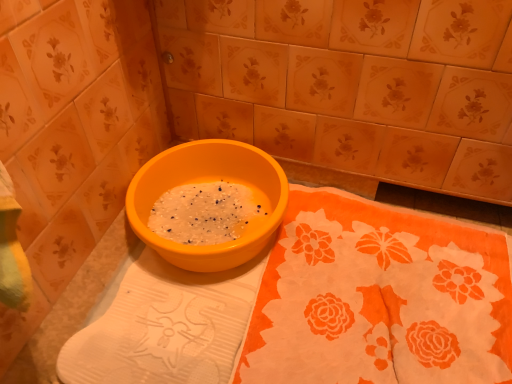
What do you see at coordinates (351, 85) in the screenshot?
I see `matte ceramic tile at center` at bounding box center [351, 85].

This screenshot has width=512, height=384. I want to click on matte ceramic tile at center, so click(x=351, y=85).

Between matte ceramic tile at center and orange fabric at center, which one has more height?

Standing taller between the two is matte ceramic tile at center.

Looking at their sizes, would you say matte ceramic tile at center is wider or thinner than orange fabric at center?

Clearly, matte ceramic tile at center has more width compared to orange fabric at center.

Is matte ceramic tile at center not inside orange fabric at center?

Yes, matte ceramic tile at center is not within orange fabric at center.

Is orange fabric at center shorter than matte ceramic tile at center?

Correct, orange fabric at center is not as tall as matte ceramic tile at center.

From a real-world perspective, is orange fabric at center physically above matte ceramic tile at center?

No, from a real-world perspective, orange fabric at center is not on top of matte ceramic tile at center.

Which is further, (382, 352) or (432, 97)?

The point (432, 97) is more distant.

How many degrees apart are the facing directions of matte ceramic tile at center and matte plastic basin at center?

There is a 88.6-degree angle between the facing directions of matte ceramic tile at center and matte plastic basin at center.

From the image's perspective, who appears lower, matte ceramic tile at center or matte plastic basin at center?

matte plastic basin at center is shown below in the image.

Is matte ceramic tile at center oriented away from matte plastic basin at center?

No.

How distant is matte ceramic tile at center from matte plastic basin at center?

matte ceramic tile at center is 9.05 inches from matte plastic basin at center.

Looking at this image, from a real-world perspective, does matte plastic basin at center stand above matte ceramic tile at center?

No.

Can you confirm if matte plastic basin at center is positioned to the right of matte ceramic tile at center?

No, matte plastic basin at center is not to the right of matte ceramic tile at center.

Locate an element on the screen. This screenshot has width=512, height=384. ceramic tile lying above the matte plastic basin at center (from the image's perspective) is located at coordinates (351, 85).

Is orange fabric at center touching matte plastic basin at center?

No, orange fabric at center is not with matte plastic basin at center.

Could you tell me if orange fabric at center is turned towards matte plastic basin at center?

No, orange fabric at center is not facing towards matte plastic basin at center.

Does orange fabric at center have a lesser height compared to matte plastic basin at center?

Yes.

Between matte plastic basin at center and orange fabric at center, which one appears on the left side from the viewer's perspective?

matte plastic basin at center is more to the left.

How many degrees apart are the facing directions of matte plastic basin at center and orange fabric at center?

The angular difference between matte plastic basin at center and orange fabric at center is 91 degrees.

Where is `tablecloth below the matte plastic basin at center (from a real-world perspective)`? The height and width of the screenshot is (384, 512). tablecloth below the matte plastic basin at center (from a real-world perspective) is located at coordinates (379, 298).

From a real-world perspective, is matte plastic basin at center located higher than orange fabric at center?

Indeed, from a real-world perspective, matte plastic basin at center stands above orange fabric at center.

Identify the location of ceramic tile located on the right of orange fabric at center. The height and width of the screenshot is (384, 512). point(351,85).

Locate an element on the screen. This screenshot has height=384, width=512. tablecloth that is on the left side of matte ceramic tile at center is located at coordinates (379, 298).

Estimate the real-world distances between objects in this image. Which object is further from matte ceramic tile at center, orange fabric at center or matte plastic basin at center?

Among the two, orange fabric at center is located further to matte ceramic tile at center.

Considering their positions, is orange fabric at center positioned closer to matte plastic basin at center than matte ceramic tile at center?

matte ceramic tile at center.

When comparing their distances from orange fabric at center, does matte plastic basin at center or matte ceramic tile at center seem further?

matte ceramic tile at center is positioned further to the anchor orange fabric at center.

Which object lies nearer to the anchor point orange fabric at center, matte ceramic tile at center or matte plastic basin at center?

matte plastic basin at center lies closer to orange fabric at center than the other object.

Which object lies nearer to the anchor point matte plastic basin at center, matte ceramic tile at center or orange fabric at center?

Among the two, matte ceramic tile at center is located nearer to matte plastic basin at center.

Based on their spatial positions, is matte plastic basin at center or orange fabric at center closer to matte ceramic tile at center?

matte plastic basin at center.

This screenshot has height=384, width=512. In order to click on basin between matte ceramic tile at center and orange fabric at center vertically in this screenshot , I will do `click(210, 181)`.